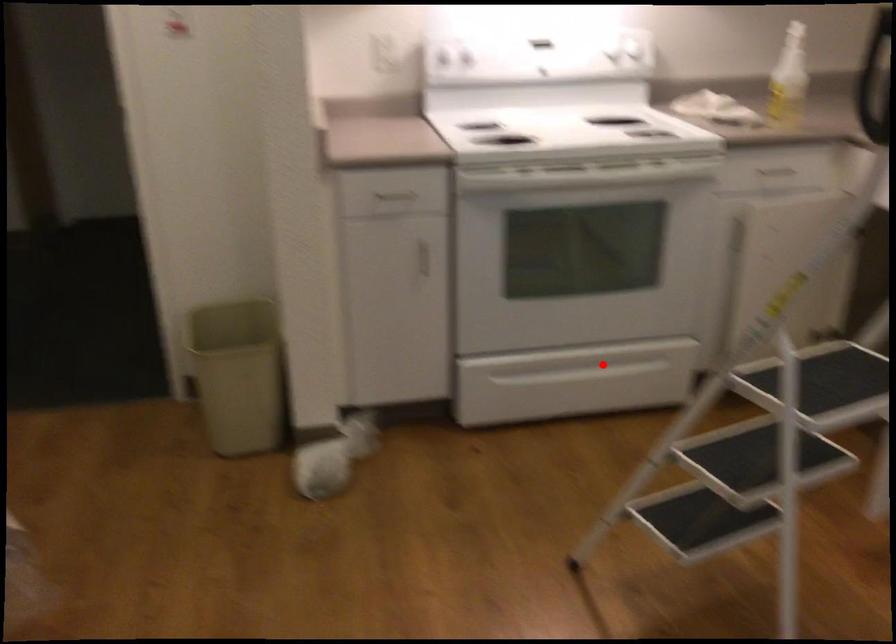
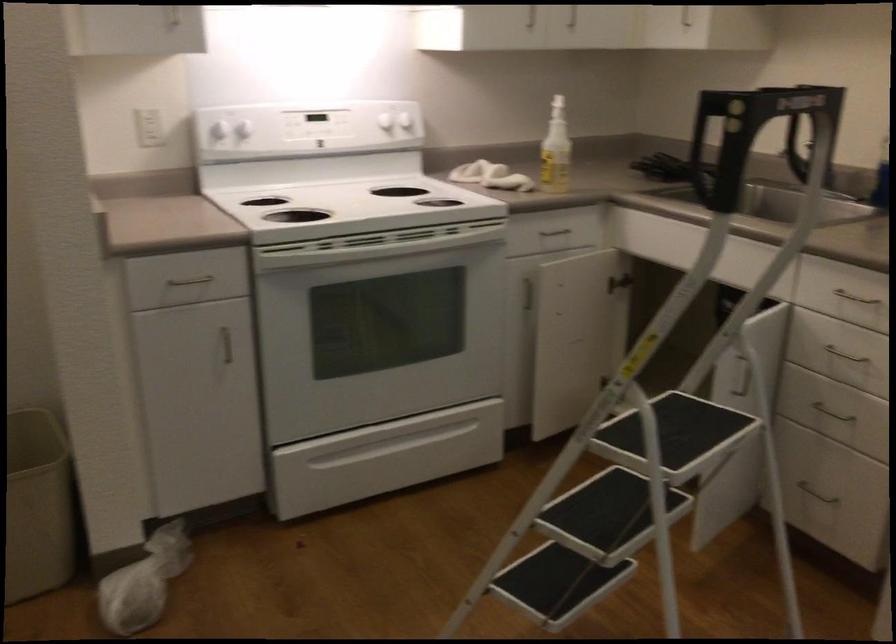
Find the pixel in the second image that matches the highlighted location in the first image.

(416, 433)